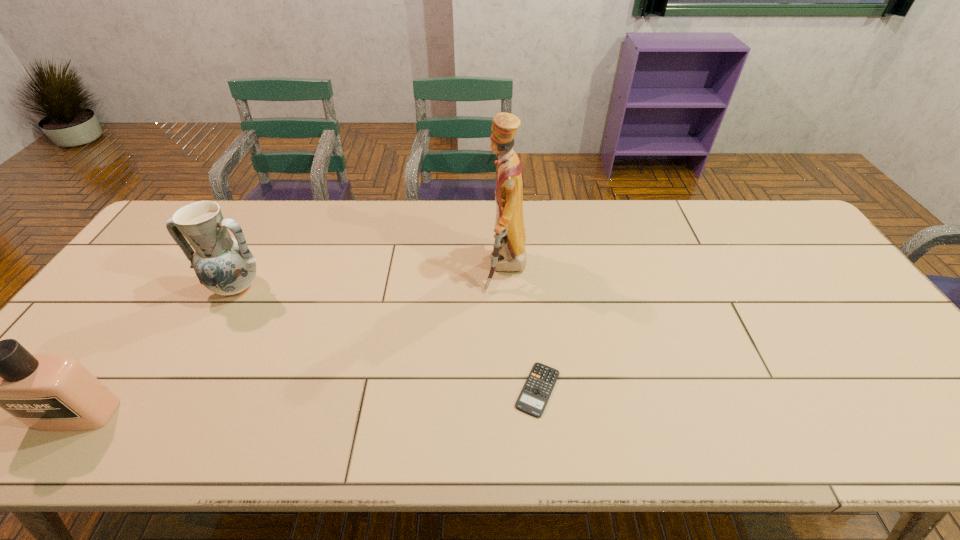
Where is `calculator present at the near edge`? calculator present at the near edge is located at coordinates (534, 396).

The image size is (960, 540). Identify the location of object that is at the left edge. (47, 392).

Where is `object that is at the near left corner`? This screenshot has height=540, width=960. object that is at the near left corner is located at coordinates (47, 392).

This screenshot has width=960, height=540. Find the location of `vacant space at the far edge of the desktop`. vacant space at the far edge of the desktop is located at coordinates (452, 245).

Identify the location of vacant space at the near edge of the desktop. (108, 444).

Image resolution: width=960 pixels, height=540 pixels. What are the coordinates of `vacant space at the left edge` in the screenshot? It's located at (148, 293).

Where is `free location at the far right corner`? free location at the far right corner is located at coordinates (792, 224).

You are a GUI agent. You are given a task and a screenshot of the screen. Output one action in this format:
    pyautogui.click(x=<x>, y=<y>)
    Task: Click on the free space at the near right corner of the desktop
    This screenshot has width=960, height=540.
    Given the screenshot: What is the action you would take?
    pyautogui.click(x=949, y=439)

You are a GUI agent. You are given a task and a screenshot of the screen. Output one action in this format:
    pyautogui.click(x=<x>, y=<y>)
    Task: Click on the vacant point located between the tallest object and the second object from left to right
    This screenshot has height=540, width=960.
    Given the screenshot: What is the action you would take?
    pyautogui.click(x=371, y=278)

Locate an element on the screen. This screenshot has width=960, height=540. empty space between the tallest object and the calculator is located at coordinates (521, 329).